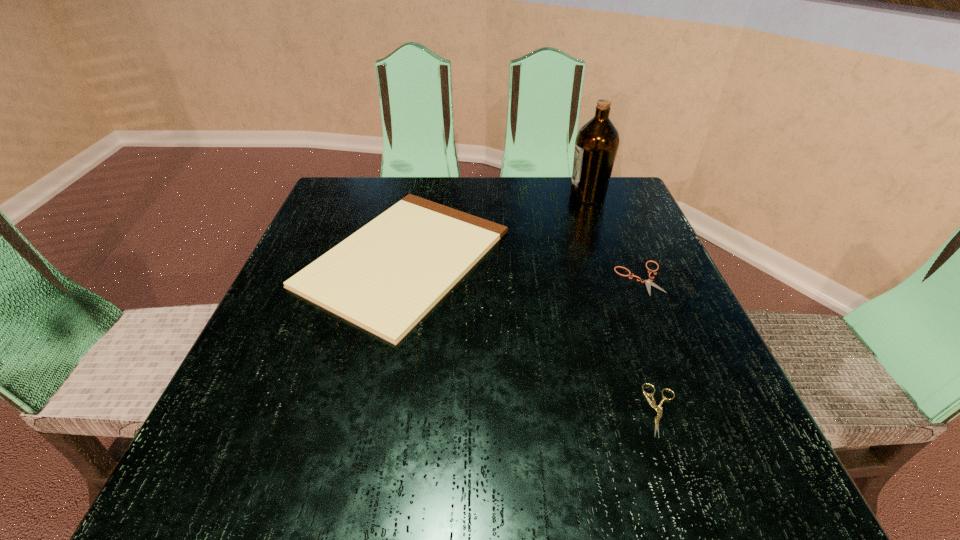
Locate an element on the screen. Image resolution: width=960 pixels, height=540 pixels. the tallest object is located at coordinates (597, 142).

You are a GUI agent. You are given a task and a screenshot of the screen. Output one action in this format:
    pyautogui.click(x=<x>, y=<y>)
    Task: Click on the clipboard
    This screenshot has width=960, height=540.
    Given the screenshot: What is the action you would take?
    click(x=385, y=277)

Identify the location of the leftmost object. (385, 277).

This screenshot has width=960, height=540. Find the location of `the nearest object`. the nearest object is located at coordinates (652, 403).

Identify the location of the farther shears. (648, 282).

The width and height of the screenshot is (960, 540). Identify the location of vacant space located on the label of the olive oil. (464, 195).

At what (x,y) coordinates should I click in order to perform the action: click on vacant area situated on the label of the olive oil. Please return your answer as a coordinate pair (x, y). The width and height of the screenshot is (960, 540). Looking at the image, I should click on (412, 195).

Where is `free space located on the label of the olive oil`? free space located on the label of the olive oil is located at coordinates (548, 195).

The width and height of the screenshot is (960, 540). What are the coordinates of `free space located on the front of the leftmost object` in the screenshot? It's located at (372, 415).

Locate an element on the screen. The width and height of the screenshot is (960, 540). free space located 0.240m on the back of the nearest object is located at coordinates (617, 281).